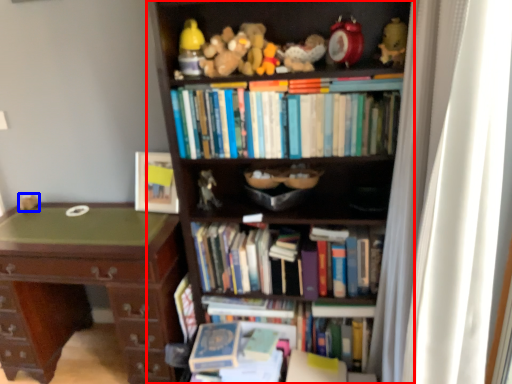
Question: Which object is closer to the camera taking this photo, bookcase (highlighted by a red box) or toy (highlighted by a blue box)?

Choices:
 (A) bookcase
 (B) toy

Answer: (A)